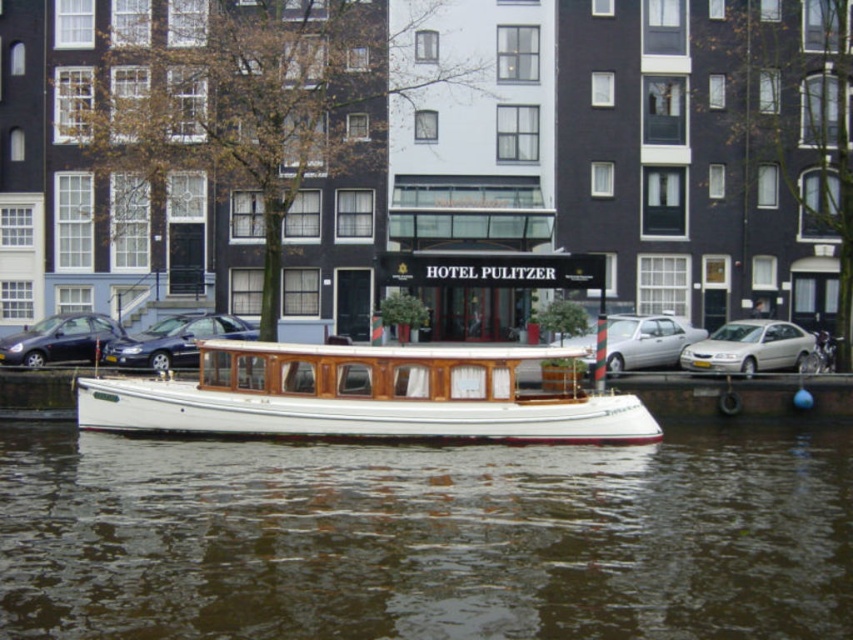
Who is shorter, transparent water at center or white wood boat at center?

transparent water at center is shorter.

Is transparent water at center positioned before white wood boat at center?

Yes, it is in front of white wood boat at center.

What do you see at coordinates (425, 538) in the screenshot?
I see `transparent water at center` at bounding box center [425, 538].

Identify the location of transparent water at center. The image size is (853, 640). (425, 538).

Can you confirm if white wood boat at center is positioned to the left of silver metallic sedan at center?

Yes, white wood boat at center is to the left of silver metallic sedan at center.

Find the location of a particular element. The image size is (853, 640). white wood boat at center is located at coordinates (366, 396).

This screenshot has width=853, height=640. What are the coordinates of `white wood boat at center` in the screenshot? It's located at (366, 396).

Can you confirm if silver metallic sedan at center is shorter than matte black car at left?

Incorrect, silver metallic sedan at center's height does not fall short of matte black car at left's.

Where is `silver metallic sedan at center`? The image size is (853, 640). silver metallic sedan at center is located at coordinates (646, 340).